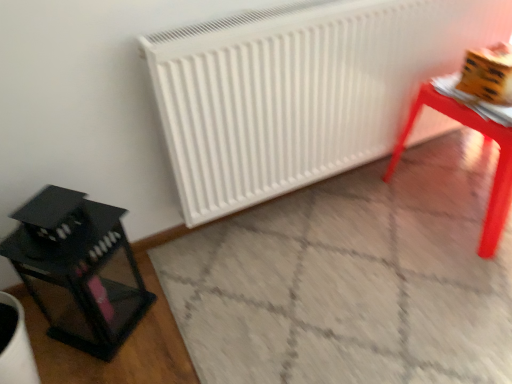
Question: Is smooth glossy table at right inside the boundaries of white matte radiator at center, or outside?

Choices:
 (A) inside
 (B) outside

Answer: (B)

Question: Would you say smooth glossy table at right is to the left or to the right of white matte radiator at center in the picture?

Choices:
 (A) right
 (B) left

Answer: (A)

Question: Which object is positioned closest to the white matte radiator at center?

Choices:
 (A) black glass lantern at left
 (B) smooth glossy table at right

Answer: (B)

Question: Which is nearer to the black glass lantern at left?

Choices:
 (A) white matte radiator at center
 (B) smooth glossy table at right

Answer: (A)